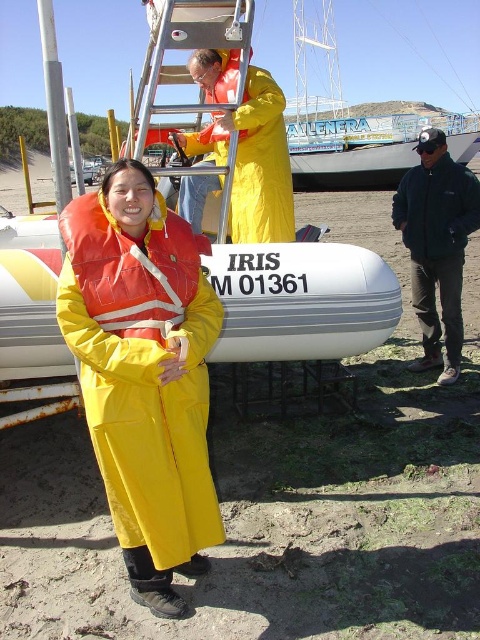
Question: Can you confirm if orange/yellow fabric life jacket at center is positioned below yellow matte life jacket at upper center?

Choices:
 (A) no
 (B) yes

Answer: (B)

Question: Which of the following is the farthest from the observer?

Choices:
 (A) (180, 28)
 (B) (177, 136)
 (C) (420, 141)

Answer: (C)

Question: In this image, where is yellow matte raincoat at center located relative to yellow matte life jacket at upper center?

Choices:
 (A) below
 (B) above

Answer: (A)

Question: Does orange/yellow fabric life jacket at center have a larger size compared to yellow matte life jacket at upper center?

Choices:
 (A) no
 (B) yes

Answer: (A)

Question: Among these points, which one is nearest to the camera?

Choices:
 (A) (223, 67)
 (B) (264, 172)

Answer: (A)

Question: Among these points, which one is farthest from the camera?

Choices:
 (A) (84, 276)
 (B) (104, 314)

Answer: (B)